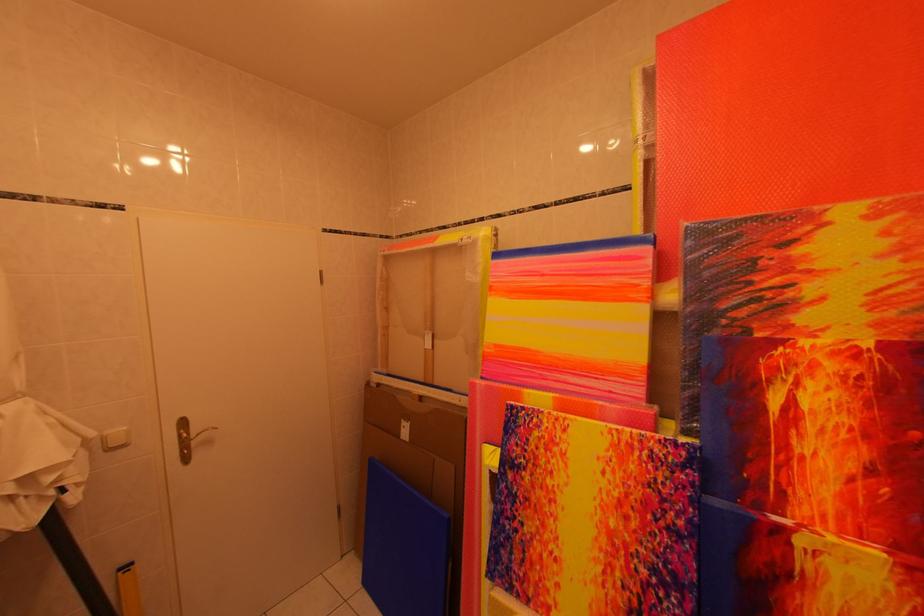
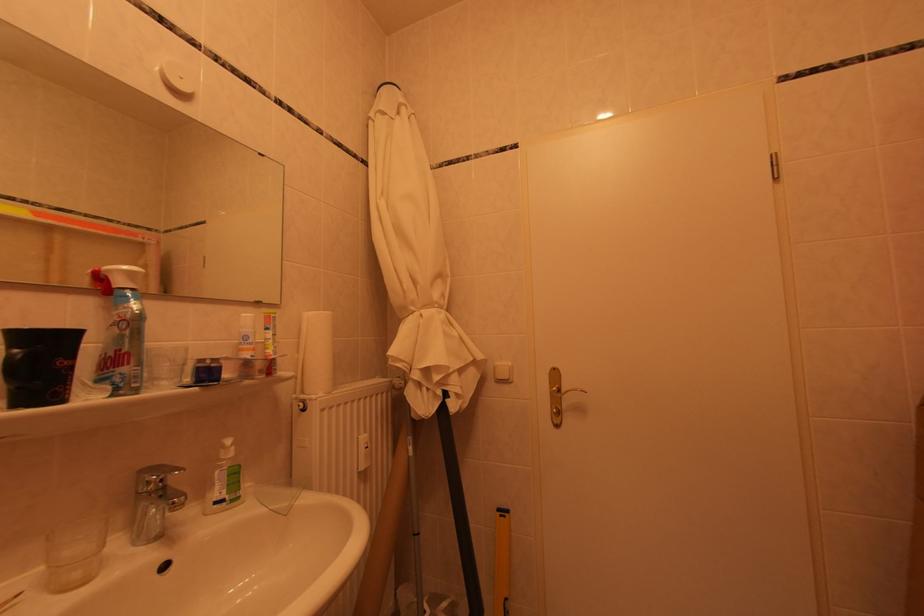
Question: Based on the continuous images, in which direction is the camera rotating? Reply with the corresponding letter.

Choices:
 (A) Left
 (B) Right
 (C) Up
 (D) Down

Answer: (A)